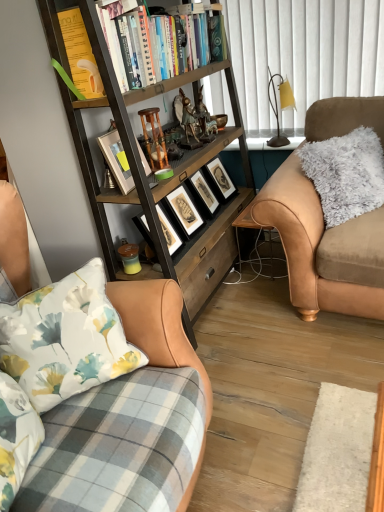
Question: Considering the relative sizes of wooden bookcase at left and metallic gold lamp at upper right in the image provided, is wooden bookcase at left bigger than metallic gold lamp at upper right?

Choices:
 (A) yes
 (B) no

Answer: (A)

Question: Considering the relative sizes of wooden bookcase at left and metallic gold lamp at upper right in the image provided, is wooden bookcase at left thinner than metallic gold lamp at upper right?

Choices:
 (A) yes
 (B) no

Answer: (B)

Question: Is wooden bookcase at left outside metallic gold lamp at upper right?

Choices:
 (A) no
 (B) yes

Answer: (B)

Question: Is wooden bookcase at left not near metallic gold lamp at upper right?

Choices:
 (A) no
 (B) yes

Answer: (A)

Question: Is wooden bookcase at left shorter than metallic gold lamp at upper right?

Choices:
 (A) no
 (B) yes

Answer: (A)

Question: Does wooden bookcase at left come in front of metallic gold lamp at upper right?

Choices:
 (A) yes
 (B) no

Answer: (A)

Question: From the image's perspective, is wooden bookcase at left above brown leather desk at center?

Choices:
 (A) yes
 (B) no

Answer: (A)

Question: Considering the relative sizes of wooden bookcase at left and brown leather desk at center in the image provided, is wooden bookcase at left shorter than brown leather desk at center?

Choices:
 (A) yes
 (B) no

Answer: (B)

Question: Does wooden bookcase at left have a greater width compared to brown leather desk at center?

Choices:
 (A) yes
 (B) no

Answer: (A)

Question: Does wooden bookcase at left come in front of brown leather desk at center?

Choices:
 (A) no
 (B) yes

Answer: (B)

Question: From a real-world perspective, is wooden bookcase at left located higher than brown leather desk at center?

Choices:
 (A) yes
 (B) no

Answer: (A)

Question: Are wooden bookcase at left and brown leather desk at center located far from each other?

Choices:
 (A) yes
 (B) no

Answer: (B)

Question: Considering the relative sizes of brown leather couch at left, which is the first studio couch in front-to-back order, and wooden bookcase at left in the image provided, is brown leather couch at left, which is the first studio couch in front-to-back order, taller than wooden bookcase at left?

Choices:
 (A) yes
 (B) no

Answer: (B)